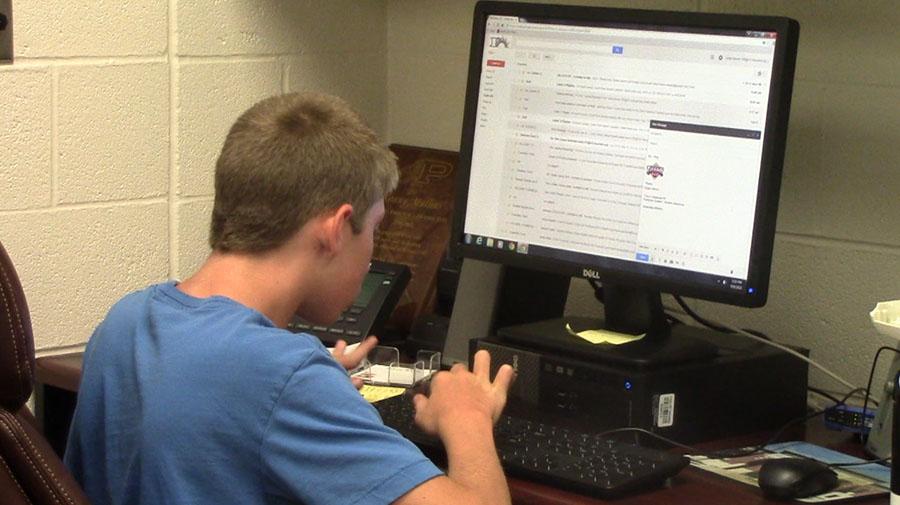
Locate an element on the screen. Image resolution: width=900 pixels, height=505 pixels. wall is located at coordinates (106, 128).